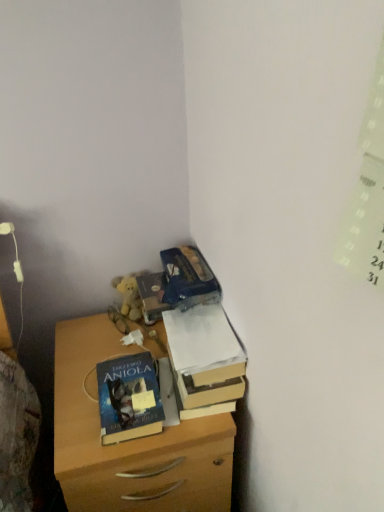
Where is `vacant region to the left of blue matte book at center`? This screenshot has height=512, width=384. vacant region to the left of blue matte book at center is located at coordinates (74, 401).